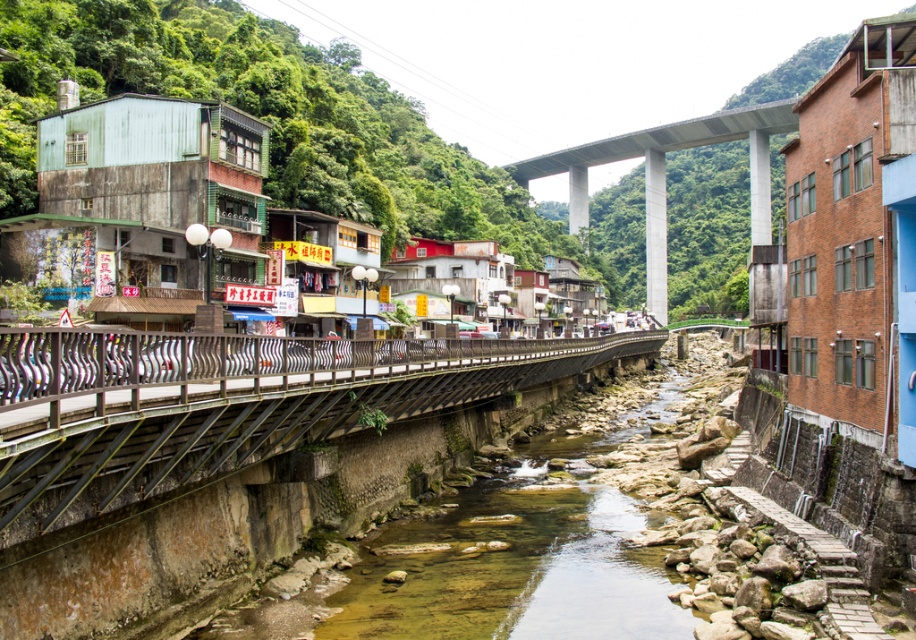
Between metallic gray rail at center and concrete bridge at upper center, which one appears on the left side from the viewer's perspective?

Positioned to the left is metallic gray rail at center.

Can you confirm if metallic gray rail at center is shorter than concrete bridge at upper center?

Indeed, metallic gray rail at center has a lesser height compared to concrete bridge at upper center.

Which is behind, point (485, 396) or point (744, 129)?

Positioned behind is point (744, 129).

Locate an element on the screen. metallic gray rail at center is located at coordinates (227, 404).